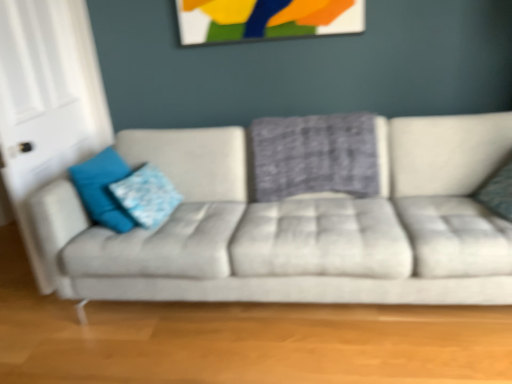
Question: From a real-world perspective, is blue fabric pillow at left, marked as the fourth pillow in a right-to-left arrangement, positioned over teal fabric pillow at right, marked as the 1th pillow in a right-to-left arrangement, based on gravity?

Choices:
 (A) yes
 (B) no

Answer: (A)

Question: Is blue fabric pillow at left, marked as the fourth pillow in a right-to-left arrangement, taller than teal fabric pillow at right, which is the 4th pillow in left-to-right order?

Choices:
 (A) yes
 (B) no

Answer: (A)

Question: Does blue fabric pillow at left, the 1th pillow viewed from the left, appear on the left side of teal fabric pillow at right, marked as the 1th pillow in a right-to-left arrangement?

Choices:
 (A) no
 (B) yes

Answer: (B)

Question: Considering the relative sizes of blue fabric pillow at left, the 1th pillow viewed from the left, and teal fabric pillow at right, marked as the 1th pillow in a right-to-left arrangement, in the image provided, is blue fabric pillow at left, the 1th pillow viewed from the left, smaller than teal fabric pillow at right, marked as the 1th pillow in a right-to-left arrangement,?

Choices:
 (A) yes
 (B) no

Answer: (B)

Question: Considering the relative sizes of blue fabric pillow at left, marked as the fourth pillow in a right-to-left arrangement, and teal fabric pillow at right, marked as the 1th pillow in a right-to-left arrangement, in the image provided, is blue fabric pillow at left, marked as the fourth pillow in a right-to-left arrangement, shorter than teal fabric pillow at right, marked as the 1th pillow in a right-to-left arrangement,?

Choices:
 (A) yes
 (B) no

Answer: (B)

Question: From a real-world perspective, is blue fabric pillow at left, the 1th pillow viewed from the left, physically located above or below white glossy door at left?

Choices:
 (A) above
 (B) below

Answer: (B)

Question: Does point (97, 175) appear closer or farther from the camera than point (72, 43)?

Choices:
 (A) farther
 (B) closer

Answer: (B)

Question: Would you say blue fabric pillow at left, marked as the fourth pillow in a right-to-left arrangement, is to the left or to the right of white glossy door at left in the picture?

Choices:
 (A) right
 (B) left

Answer: (A)

Question: Considering the positions of blue fabric pillow at left, marked as the fourth pillow in a right-to-left arrangement, and white glossy door at left in the image, is blue fabric pillow at left, marked as the fourth pillow in a right-to-left arrangement, wider or thinner than white glossy door at left?

Choices:
 (A) wide
 (B) thin

Answer: (A)

Question: Looking at the image, does blue fabric pillow at left, acting as the 2th pillow starting from the left, seem bigger or smaller compared to teal fabric pillow at right, which is the 4th pillow in left-to-right order?

Choices:
 (A) big
 (B) small

Answer: (A)

Question: Is blue fabric pillow at left, which ranks as the third pillow in right-to-left order, taller or shorter than teal fabric pillow at right, which is the 4th pillow in left-to-right order?

Choices:
 (A) short
 (B) tall

Answer: (B)

Question: From a real-world perspective, relative to teal fabric pillow at right, marked as the 1th pillow in a right-to-left arrangement, is blue fabric pillow at left, which ranks as the third pillow in right-to-left order, vertically above or below?

Choices:
 (A) above
 (B) below

Answer: (B)

Question: Considering the positions of point (174, 198) and point (479, 190), is point (174, 198) closer or farther from the camera than point (479, 190)?

Choices:
 (A) closer
 (B) farther

Answer: (B)

Question: From a real-world perspective, relative to painted wood picture frame at upper center, is plaid fabric pillow at center, which is the third pillow in left-to-right order, vertically above or below?

Choices:
 (A) above
 (B) below

Answer: (B)

Question: Considering the positions of plaid fabric pillow at center, which is the third pillow in left-to-right order, and painted wood picture frame at upper center in the image, is plaid fabric pillow at center, which is the third pillow in left-to-right order, taller or shorter than painted wood picture frame at upper center?

Choices:
 (A) short
 (B) tall

Answer: (B)